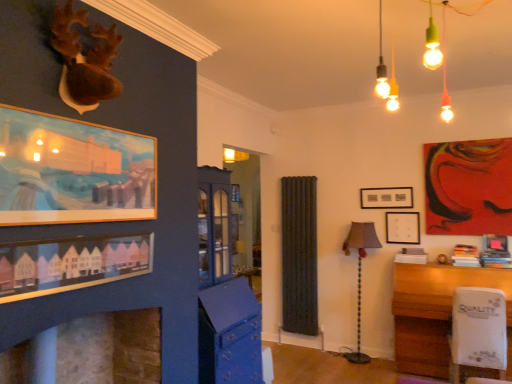
Question: From a real-world perspective, is wooden framed painting at upper left, marked as the second picture frame in a front-to-back arrangement, below white plastic swivel chair at lower right?

Choices:
 (A) yes
 (B) no

Answer: (B)

Question: Is wooden framed painting at upper left, marked as the second picture frame in a front-to-back arrangement, next to white plastic swivel chair at lower right?

Choices:
 (A) no
 (B) yes

Answer: (A)

Question: Can you confirm if wooden framed painting at upper left, acting as the first picture frame starting from the left, is positioned to the right of white plastic swivel chair at lower right?

Choices:
 (A) no
 (B) yes

Answer: (A)

Question: Does wooden framed painting at upper left, the fourth picture frame when ordered from back to front, have a lesser height compared to white plastic swivel chair at lower right?

Choices:
 (A) yes
 (B) no

Answer: (A)

Question: Considering the relative sizes of wooden framed painting at upper left, acting as the first picture frame starting from the left, and white plastic swivel chair at lower right in the image provided, is wooden framed painting at upper left, acting as the first picture frame starting from the left, smaller than white plastic swivel chair at lower right?

Choices:
 (A) no
 (B) yes

Answer: (B)

Question: In the image, is matte pink picture frame at upper right, which is the 3th picture frame in front-to-back order, on the left side or the right side of stone fireplace at lower left?

Choices:
 (A) left
 (B) right

Answer: (B)

Question: Is matte pink picture frame at upper right, which is the third picture frame from back to front, in front of or behind stone fireplace at lower left in the image?

Choices:
 (A) front
 (B) behind

Answer: (B)

Question: Would you say matte pink picture frame at upper right, which is the 3th picture frame in front-to-back order, is inside or outside stone fireplace at lower left?

Choices:
 (A) outside
 (B) inside

Answer: (A)

Question: In terms of width, does matte pink picture frame at upper right, placed as the fifth picture frame when sorted from left to right, look wider or thinner when compared to stone fireplace at lower left?

Choices:
 (A) wide
 (B) thin

Answer: (B)

Question: Would you say wooden framed painting at upper left, placed as the fifth picture frame when sorted from right to left, is to the left or to the right of matte pink picture frame at upper right, placed as the fifth picture frame when sorted from left to right, in the picture?

Choices:
 (A) right
 (B) left

Answer: (B)

Question: Based on their sizes in the image, would you say wooden framed painting at upper left, acting as the first picture frame starting from the left, is bigger or smaller than matte pink picture frame at upper right, which is the 3th picture frame in front-to-back order?

Choices:
 (A) small
 (B) big

Answer: (B)

Question: Considering the positions of wooden framed painting at upper left, placed as the fifth picture frame when sorted from right to left, and matte pink picture frame at upper right, which is the 3th picture frame in front-to-back order, in the image, is wooden framed painting at upper left, placed as the fifth picture frame when sorted from right to left, wider or thinner than matte pink picture frame at upper right, which is the 3th picture frame in front-to-back order,?

Choices:
 (A) thin
 (B) wide

Answer: (A)

Question: Is point (70, 221) positioned closer to the camera than point (502, 235)?

Choices:
 (A) closer
 (B) farther

Answer: (A)

Question: Considering the positions of matte black picture frame at center, which is counted as the 4th picture frame, starting from the front, and white plastic swivel chair at lower right in the image, is matte black picture frame at center, which is counted as the 4th picture frame, starting from the front, wider or thinner than white plastic swivel chair at lower right?

Choices:
 (A) thin
 (B) wide

Answer: (A)

Question: From the image's perspective, relative to white plastic swivel chair at lower right, is matte black picture frame at center, acting as the second picture frame starting from the right, above or below?

Choices:
 (A) above
 (B) below

Answer: (A)